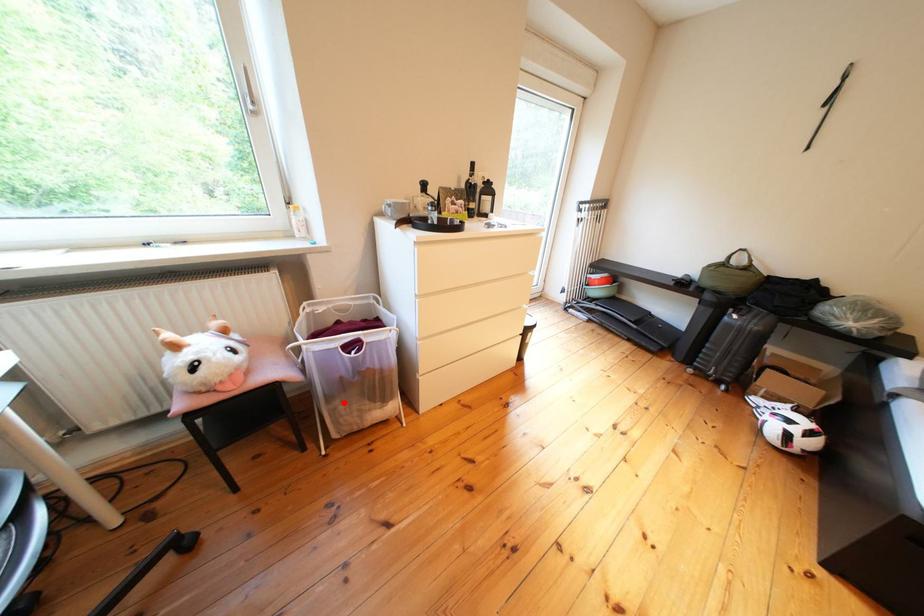
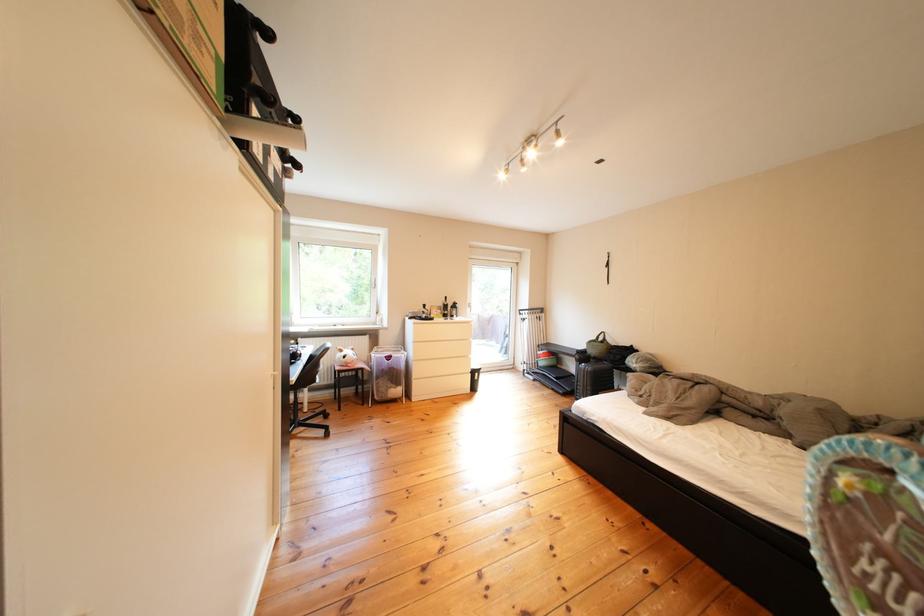
Locate, in the second image, the point that corresponds to the highlighted location in the first image.

(392, 382)